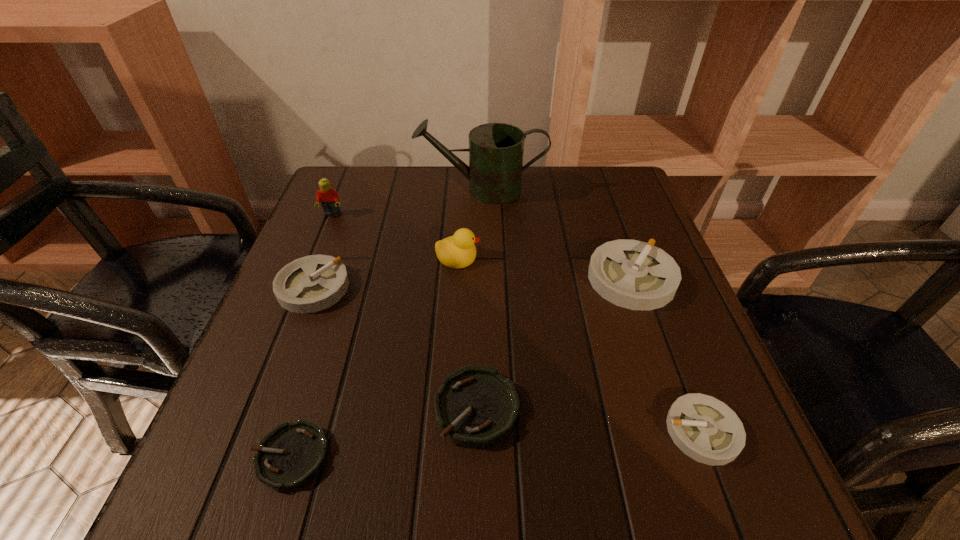
Identify which ashtray is the closest to the left green ashtray. Please provide its 2D coordinates. Your answer should be formatted as a tuple, i.e. [(x, y)], where the tuple contains the x and y coordinates of a point satisfying the conditions above.

[(477, 407)]

Where is `the closest gray ashtray to the tallest ashtray`? The height and width of the screenshot is (540, 960). the closest gray ashtray to the tallest ashtray is located at coordinates (704, 428).

This screenshot has width=960, height=540. I want to click on the closest gray ashtray to the nearest gray ashtray, so click(636, 275).

The width and height of the screenshot is (960, 540). I want to click on blank space that satisfies the following two spatial constraints: 1. with the spout on the watering can; 2. on the left side of the tallest ashtray, so click(x=482, y=279).

Where is `vacant region that satisfies the following two spatial constraints: 1. on the face of the duckling; 2. on the back side of the third ashtray from right to left`? vacant region that satisfies the following two spatial constraints: 1. on the face of the duckling; 2. on the back side of the third ashtray from right to left is located at coordinates (449, 408).

Identify the location of vacant space that satisfies the following two spatial constraints: 1. on the face of the yellow duckling; 2. on the back side of the tallest ashtray. (457, 279).

You are a GUI agent. You are given a task and a screenshot of the screen. Output one action in this format:
    pyautogui.click(x=<x>, y=<y>)
    Task: Click on the free space that satisfies the following two spatial constraints: 1. on the face of the seventh nearest object; 2. on the left side of the second tallest ashtray
    The image size is (960, 540).
    Given the screenshot: What is the action you would take?
    pyautogui.click(x=302, y=287)

Image resolution: width=960 pixels, height=540 pixels. I want to click on vacant area that satisfies the following two spatial constraints: 1. on the back side of the third ashtray from right to left; 2. on the face of the third tallest object, so click(x=478, y=256).

Locate an element on the screen. blank area in the image that satisfies the following two spatial constraints: 1. on the face of the smallest gray ashtray; 2. on the left side of the duckling is located at coordinates (448, 431).

The height and width of the screenshot is (540, 960). What are the coordinates of `vacant area in the image that satisfies the following two spatial constraints: 1. on the face of the smallest gray ashtray; 2. on the left side of the Lego` in the screenshot? It's located at (245, 431).